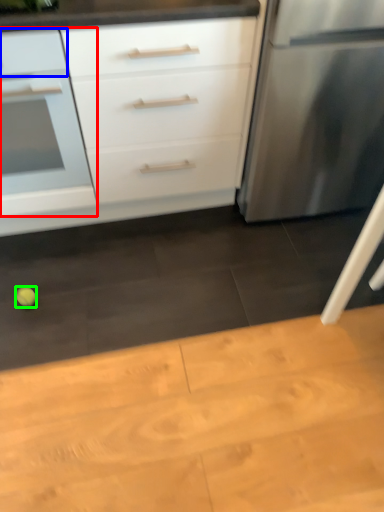
Question: Which object is positioned closest to drawer (highlighted by a red box)? Select from drawer (highlighted by a blue box) and lime (highlighted by a green box).

Choices:
 (A) drawer
 (B) lime

Answer: (A)